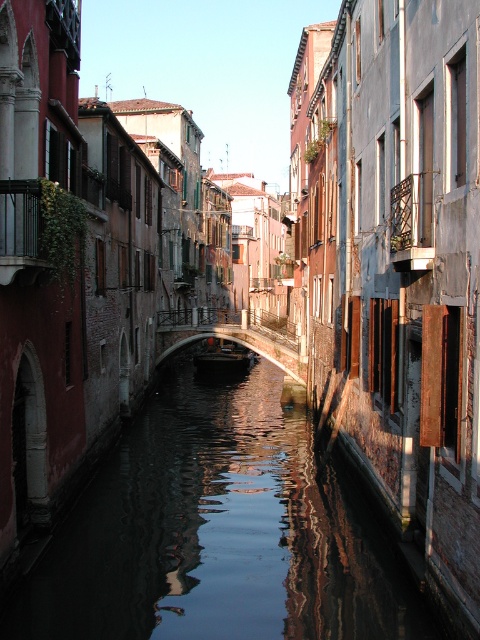
Can you confirm if reflective dark water at center is positioned to the right of wooden dark brown boat at center?

Indeed, reflective dark water at center is positioned on the right side of wooden dark brown boat at center.

Between reflective dark water at center and wooden dark brown boat at center, which one is positioned higher?

Positioned higher is wooden dark brown boat at center.

Is point (354, 499) farther from camera compared to point (220, 340)?

That is False.

This screenshot has width=480, height=640. I want to click on reflective dark water at center, so click(x=219, y=531).